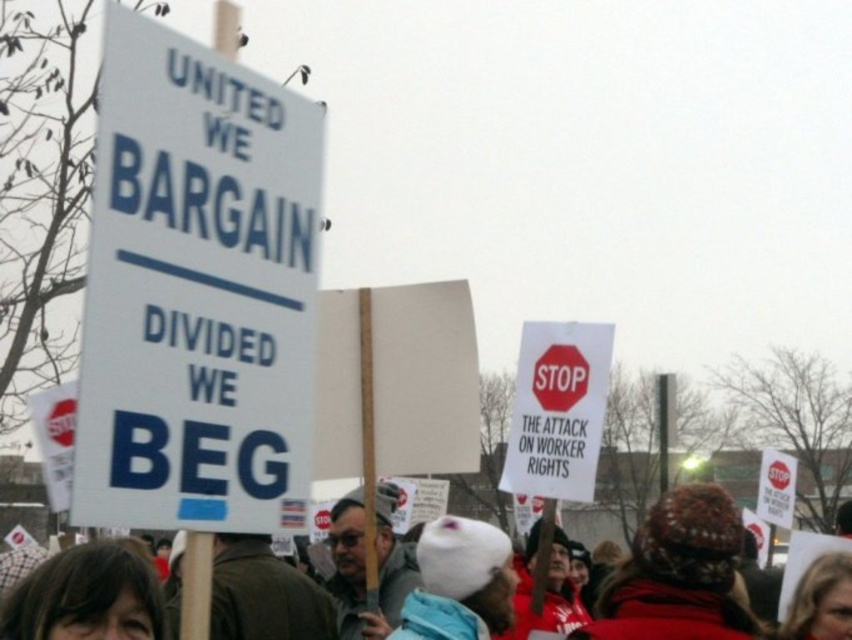
You are a photographer standing at the camera position. You want to capture a closeup of the point at coordinates point [233,218]. Your camera has a maximum focus range of 15 feet. Can you focus on that point with your current settings?

The distance of point [233,218] from the camera is 17.43 feet, which exceeds the camera maximum focus range of 15 feet. Therefore, you cannot focus on that point with your current settings.

You are a photographer trying to capture a clear shot of both the white wool hat at center and the red matte stop sign at upper center. Based on their sizes, which object should you focus on first to ensure both fit in the frame?

The white wool hat at center might be wider than red matte stop sign at upper center, so you should focus on the white wool hat at center first to ensure both fit in the frame.

What is located at the coordinates point (557, 410) in the image?

The point (557, 410) indicates a white paper sign at center.